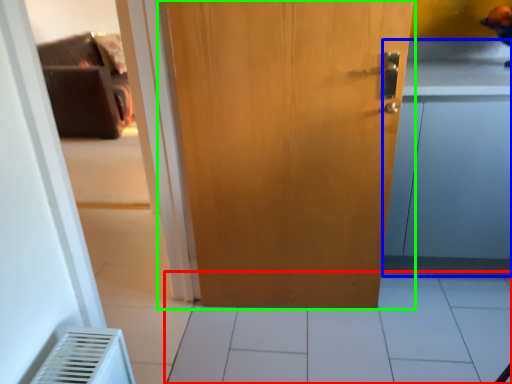
Question: Which object is the farthest from tile (highlighted by a red box)? Choose among these: cabinetry (highlighted by a blue box) or door (highlighted by a green box).

Choices:
 (A) cabinetry
 (B) door

Answer: (B)